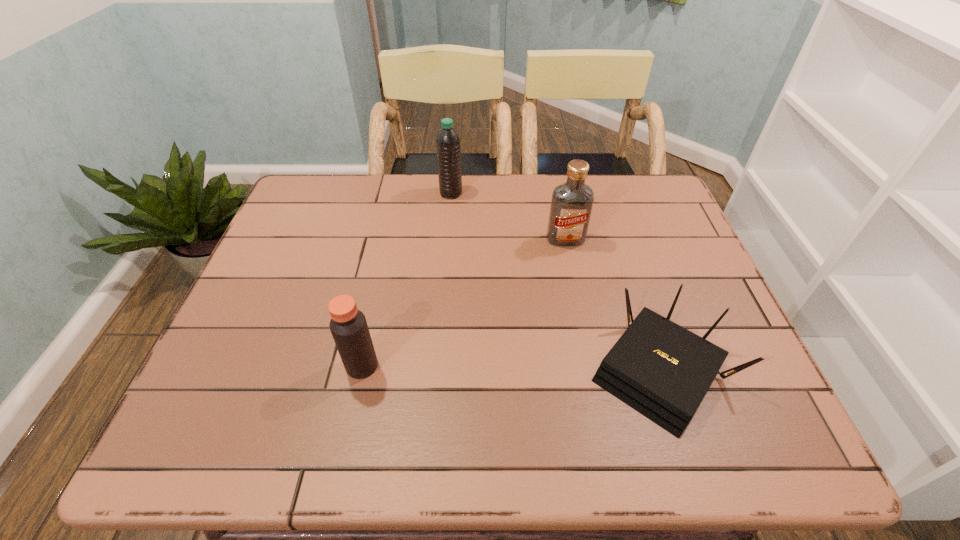
Identify the location of vacant area that lies between the third nearest object and the second object from left to right. (508, 216).

Where is `object that is the closest to the vodka`? The width and height of the screenshot is (960, 540). object that is the closest to the vodka is located at coordinates (660, 369).

Where is `object that stands as the second closest to the water bottle`? object that stands as the second closest to the water bottle is located at coordinates (660, 369).

At what (x,y) coordinates should I click in order to perform the action: click on free space that satisfies the following two spatial constraints: 1. on the front-facing side of the second farthest object; 2. on the left side of the router. Please return your answer as a coordinate pair (x, y). This screenshot has height=540, width=960. Looking at the image, I should click on (592, 373).

Where is `free spot that satisfies the following two spatial constraints: 1. on the front-facing side of the vodka; 2. on the right side of the router`? The height and width of the screenshot is (540, 960). free spot that satisfies the following two spatial constraints: 1. on the front-facing side of the vodka; 2. on the right side of the router is located at coordinates (592, 373).

This screenshot has width=960, height=540. Find the location of `vacant area that satisfies the following two spatial constraints: 1. on the back side of the second shortest object; 2. on the right side of the second object from left to right`. vacant area that satisfies the following two spatial constraints: 1. on the back side of the second shortest object; 2. on the right side of the second object from left to right is located at coordinates (399, 193).